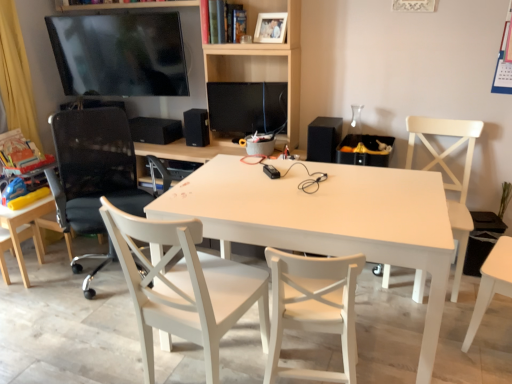
Question: From their relative heights in the image, would you say black matte speaker at right, the 3th speaker viewed from the back, is taller or shorter than black mesh office chair at left, marked as the 4th chair in a right-to-left arrangement?

Choices:
 (A) short
 (B) tall

Answer: (A)

Question: Is black matte speaker at right, which ranks as the first speaker in front-to-back order, in front of or behind black mesh office chair at left, marked as the 2th chair in a left-to-right arrangement, in the image?

Choices:
 (A) front
 (B) behind

Answer: (B)

Question: Based on their relative distances, which object is nearer to the black mesh office chair at left, marked as the 4th chair in a right-to-left arrangement?

Choices:
 (A) wooden bookshelf at upper center
 (B) light wood chair at lower left, the first chair from the left
 (C) black matte speaker at center, the first speaker from the left
 (D) white wood chair at center, which is the 4th chair from left to right
 (E) white matte chair at right, arranged as the first chair when viewed from the right

Answer: (B)

Question: Estimate the real-world distances between objects in this image. Which object is farther from the black matte speaker at right, acting as the 3th speaker starting from the left?

Choices:
 (A) white matte picture frame at upper center
 (B) white matte table at center
 (C) matte black tv at upper left
 (D) matte black monitor at center
 (E) white wood chair at center, the third chair from the left

Answer: (C)